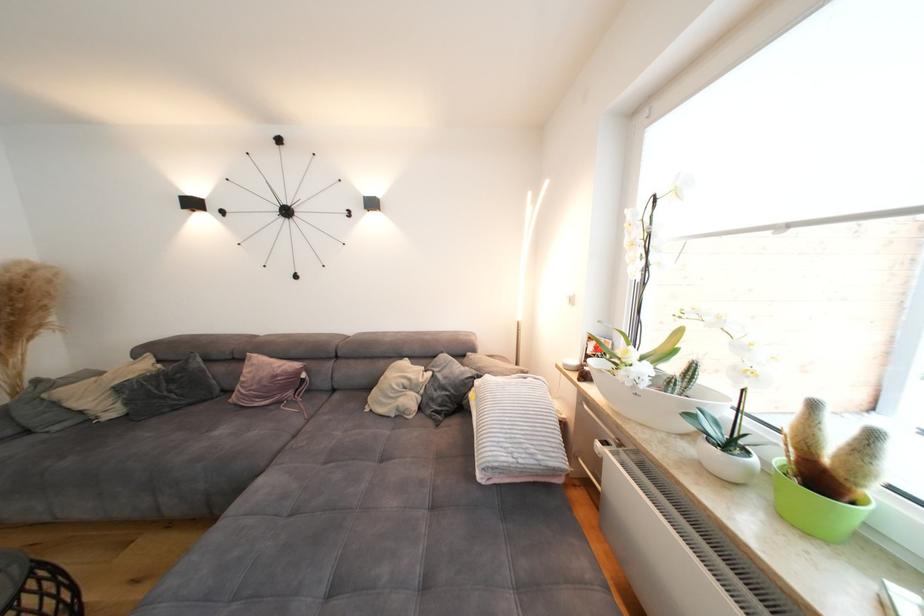
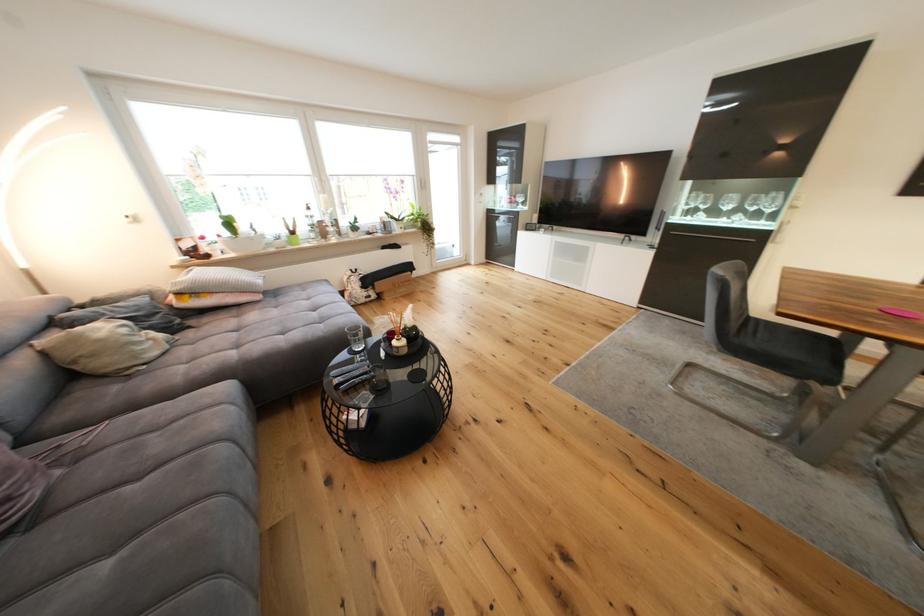
In the second image, find the point that corresponds to (x=418, y=402) in the first image.

(161, 336)